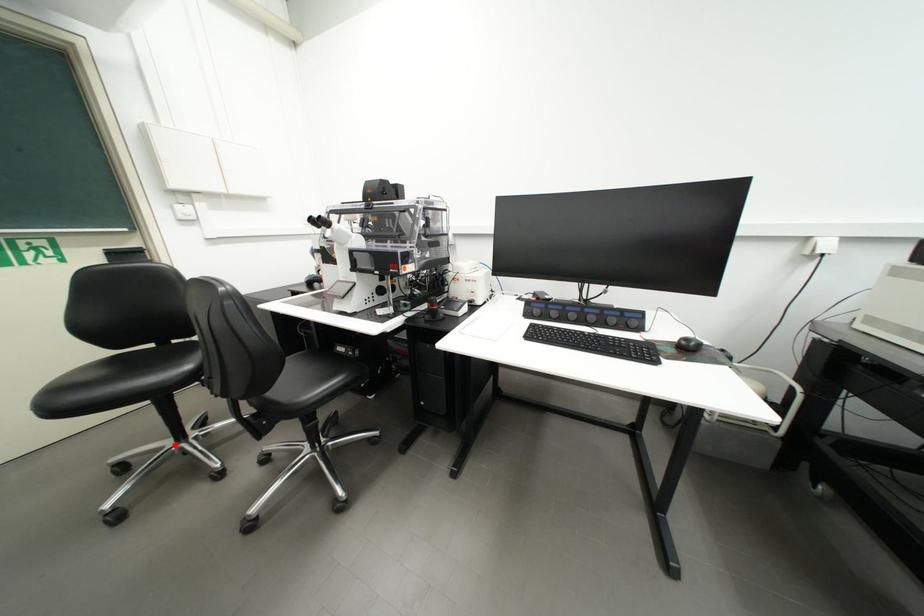
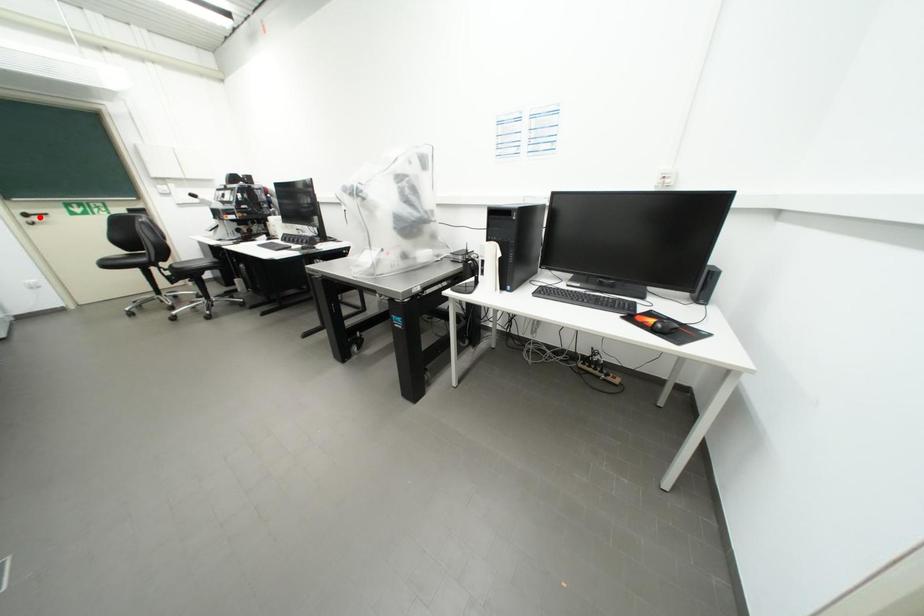
I am providing you with two images of the same scene from different viewpoints. A red point is marked on the first image and another point is marked on the second image. Does the point marked in image1 correspond to the same location as the one in image2?

No